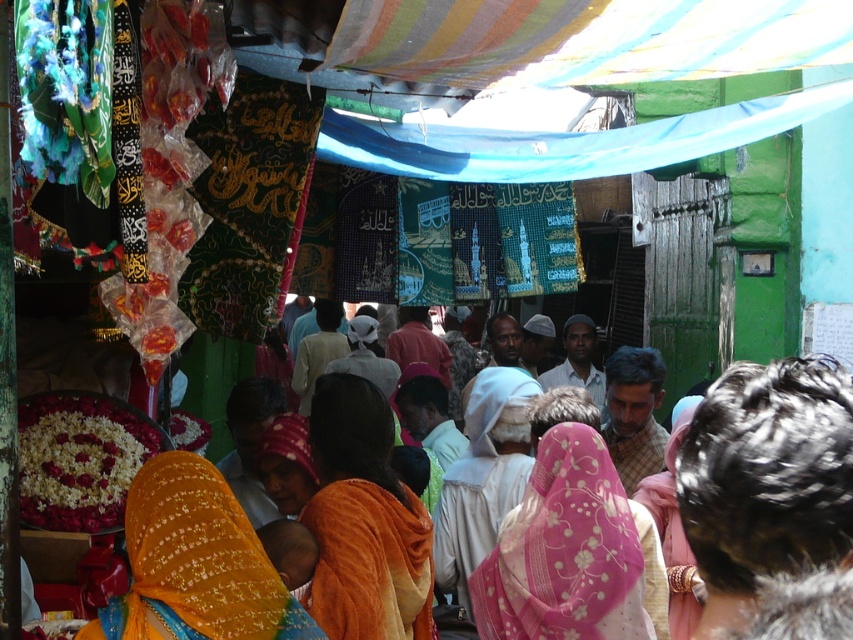
Which is more to the left, pink embroidered scarf at center or embroidered orange sari at center?

Positioned to the left is embroidered orange sari at center.

Between pink embroidered scarf at center and embroidered orange sari at center, which one has less height?

embroidered orange sari at center

Is point (602, 540) closer to viewer compared to point (223, 506)?

No.

Where is `pink embroidered scarf at center`? pink embroidered scarf at center is located at coordinates (566, 552).

Does pink embroidered scarf at center have a greater height compared to white fabric headscarf at center?

Incorrect, pink embroidered scarf at center's height is not larger of white fabric headscarf at center's.

Is pink embroidered scarf at center to the left of white fabric headscarf at center from the viewer's perspective?

Incorrect, pink embroidered scarf at center is not on the left side of white fabric headscarf at center.

Where is `pink embroidered scarf at center`? The width and height of the screenshot is (853, 640). pink embroidered scarf at center is located at coordinates (566, 552).

Does embroidered orange sari at center appear over white fabric headscarf at center?

Correct, embroidered orange sari at center is located above white fabric headscarf at center.

Who is positioned more to the left, embroidered orange sari at center or white fabric headscarf at center?

From the viewer's perspective, embroidered orange sari at center appears more on the left side.

What are the coordinates of `embroidered orange sari at center` in the screenshot? It's located at (195, 563).

I want to click on embroidered orange sari at center, so click(195, 563).